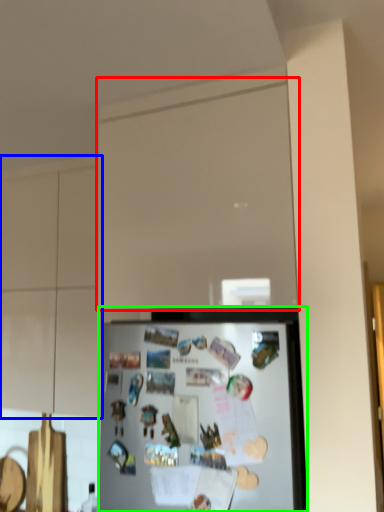
Question: Which object is positioned closest to glass door (highlighted by a red box)? Select from cabinetry (highlighted by a blue box) and refrigerator (highlighted by a green box).

Choices:
 (A) cabinetry
 (B) refrigerator

Answer: (B)